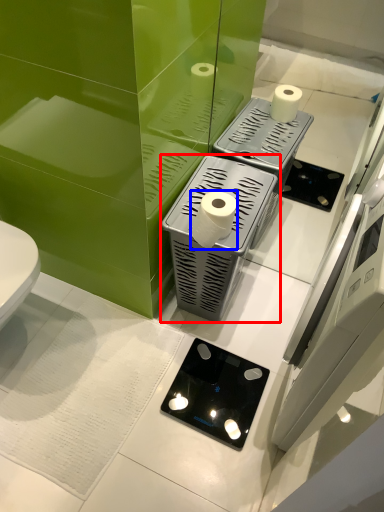
Question: Which object appears closest to the camera in this image, appliance (highlighted by a red box) or toilet paper (highlighted by a blue box)?

Choices:
 (A) appliance
 (B) toilet paper

Answer: (B)